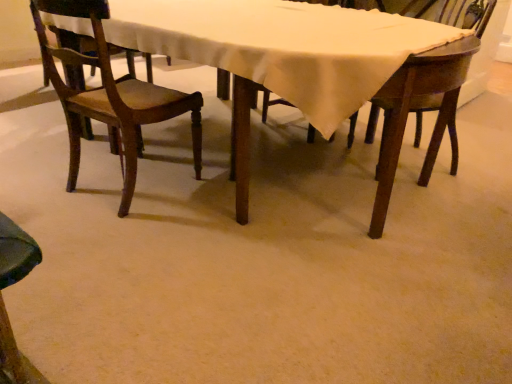
Question: Considering the positions of wooden table at center and wooden chair at upper right, positioned as the 2th chair in left-to-right order, in the image, is wooden table at center taller or shorter than wooden chair at upper right, positioned as the 2th chair in left-to-right order,?

Choices:
 (A) short
 (B) tall

Answer: (A)

Question: Is wooden table at center inside or outside of wooden chair at upper right, placed as the first chair when sorted from right to left?

Choices:
 (A) outside
 (B) inside

Answer: (A)

Question: Considering the real-world distances, which object is farthest from the wooden table at center?

Choices:
 (A) wooden chair at left, which is counted as the first chair, starting from the left
 (B) wooden chair at upper right, positioned as the 2th chair in left-to-right order

Answer: (B)

Question: Estimate the real-world distances between objects in this image. Which object is farther from the wooden table at center?

Choices:
 (A) wooden chair at left, the 2th chair from the right
 (B) wooden chair at upper right, placed as the first chair when sorted from right to left

Answer: (B)